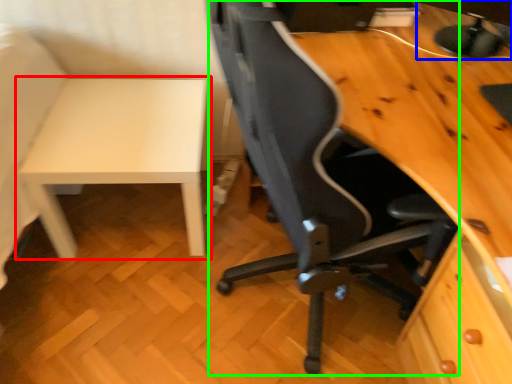
Question: Which object is the farthest from table (highlighted by a red box)? Choose among these: computer monitor (highlighted by a blue box) or chair (highlighted by a green box).

Choices:
 (A) computer monitor
 (B) chair

Answer: (A)